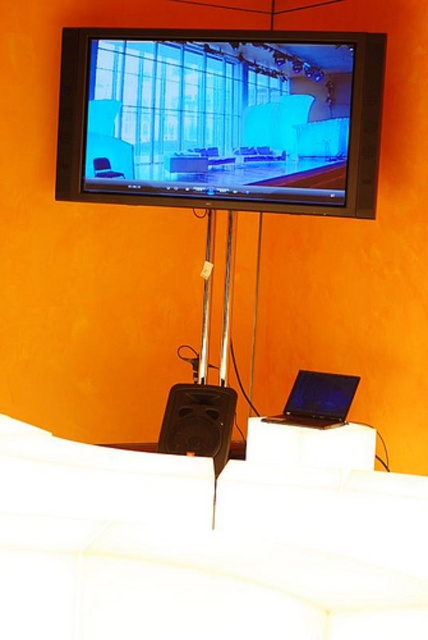
Question: Can you confirm if white fabric couch at lower center is smaller than black matte laptop at lower center?

Choices:
 (A) no
 (B) yes

Answer: (A)

Question: Is white fabric couch at lower center bigger than black matte laptop at lower center?

Choices:
 (A) yes
 (B) no

Answer: (A)

Question: Which point appears closest to the camera in this image?

Choices:
 (A) (338, 420)
 (B) (139, 502)
 (C) (237, 74)

Answer: (B)

Question: Does white fabric couch at lower center appear over flat-screen tv at upper center?

Choices:
 (A) yes
 (B) no

Answer: (B)

Question: Which object is the farthest from the black matte laptop at lower center?

Choices:
 (A) flat-screen tv at upper center
 (B) white fabric couch at lower center

Answer: (B)

Question: Considering the real-world distances, which object is closest to the black matte laptop at lower center?

Choices:
 (A) flat-screen tv at upper center
 (B) white fabric couch at lower center

Answer: (A)